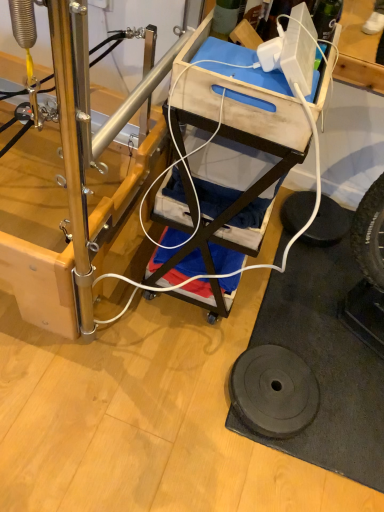
This screenshot has height=512, width=384. Find the location of `vacant area that is in front of black rubber tire at lower right`. vacant area that is in front of black rubber tire at lower right is located at coordinates (317, 264).